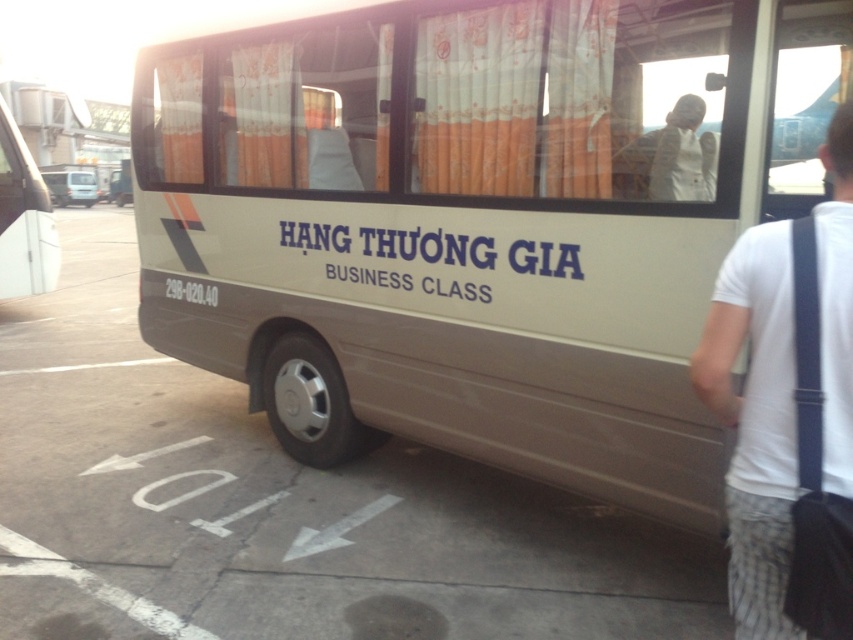
You are a passenger waiting to board the beige matte bus at center. You notice a white cotton shirt at right hanging on a nearby rack. If you want to board the bus, will the shirt be visible from inside the bus through the windows?

The beige matte bus at center is above the white cotton shirt at right, so the shirt will not be visible from inside the bus through the windows as the bus is positioned higher than the shirt.

You are a photographer standing at the airport terminal. You want to take a photo of the beige matte bus at center and the white cotton shirt at right. Since the bus is larger, how should you position yourself to include both in the frame without cropping either?

Since the beige matte bus at center is larger than the white cotton shirt at right, you should position yourself farther away from the beige matte bus at center to ensure both objects fit in the frame without cropping.